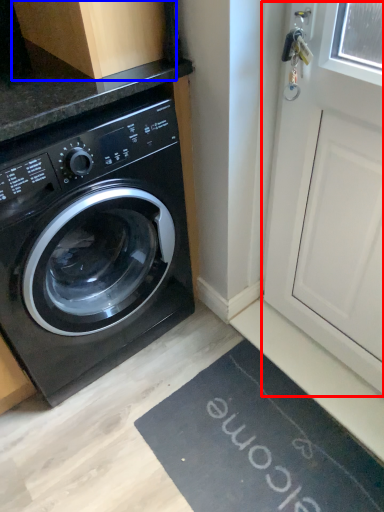
Question: Which object is further to the camera taking this photo, screen door (highlighted by a red box) or cabinetry (highlighted by a blue box)?

Choices:
 (A) screen door
 (B) cabinetry

Answer: (B)